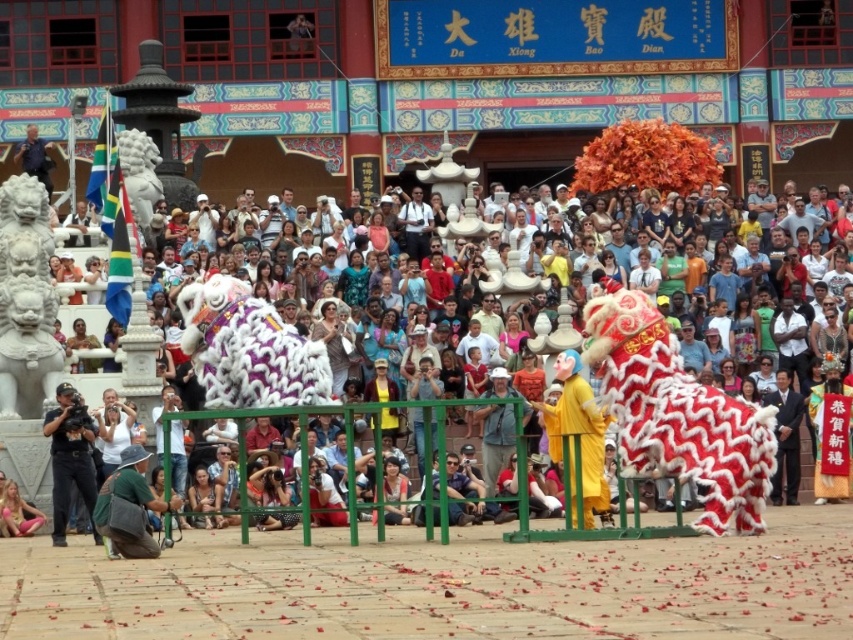
Is green fabric bag at lower left positioned before pink fabric at lower left?

Yes, green fabric bag at lower left is closer to the viewer.

From the picture: Does green fabric bag at lower left have a lesser width compared to pink fabric at lower left?

Yes.

Identify the location of green fabric bag at lower left. The height and width of the screenshot is (640, 853). (131, 506).

Who is positioned more to the right, red and white fur lion at center or fluffy white lion at center?

red and white fur lion at center

This screenshot has width=853, height=640. Describe the element at coordinates (677, 413) in the screenshot. I see `red and white fur lion at center` at that location.

The height and width of the screenshot is (640, 853). I want to click on red and white fur lion at center, so click(x=677, y=413).

Can you confirm if black matte camera at lower left is positioned below pink fabric at lower left?

No, black matte camera at lower left is not below pink fabric at lower left.

Which is above, black matte camera at lower left or pink fabric at lower left?

black matte camera at lower left is higher up.

Between point (67, 408) and point (24, 522), which one is positioned behind?

Positioned behind is point (24, 522).

This screenshot has height=640, width=853. I want to click on black matte camera at lower left, so click(x=68, y=456).